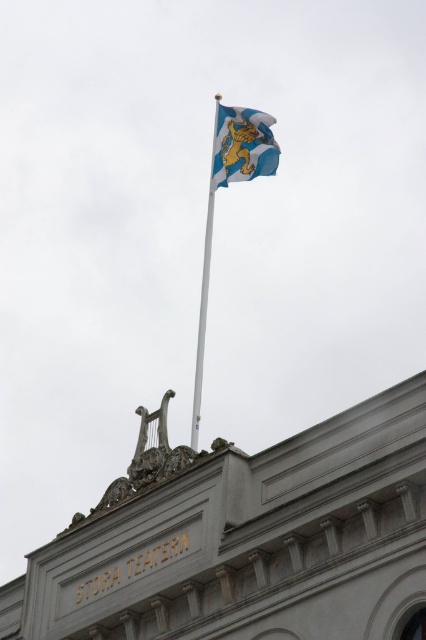
In the scene shown: Can you confirm if blue and white fabric flag at upper center is positioned to the right of white metallic flag pole at upper center?

Yes, blue and white fabric flag at upper center is to the right of white metallic flag pole at upper center.

Does point (230, 173) lie behind point (213, 198)?

No.

You are a GUI agent. You are given a task and a screenshot of the screen. Output one action in this format:
    pyautogui.click(x=<x>, y=<y>)
    Task: Click on the blue and white fabric flag at upper center
    This screenshot has width=426, height=640.
    Given the screenshot: What is the action you would take?
    pyautogui.click(x=242, y=145)